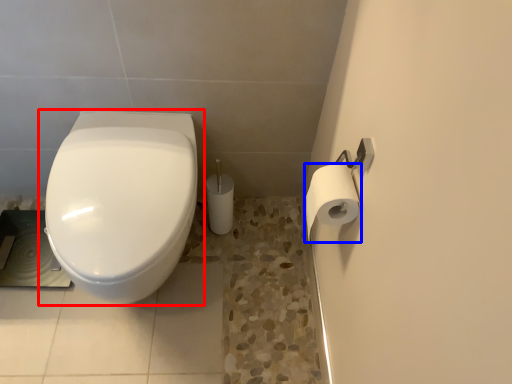
Question: Among these objects, which one is farthest to the camera, toilet (highlighted by a red box) or toilet paper (highlighted by a blue box)?

Choices:
 (A) toilet
 (B) toilet paper

Answer: (A)